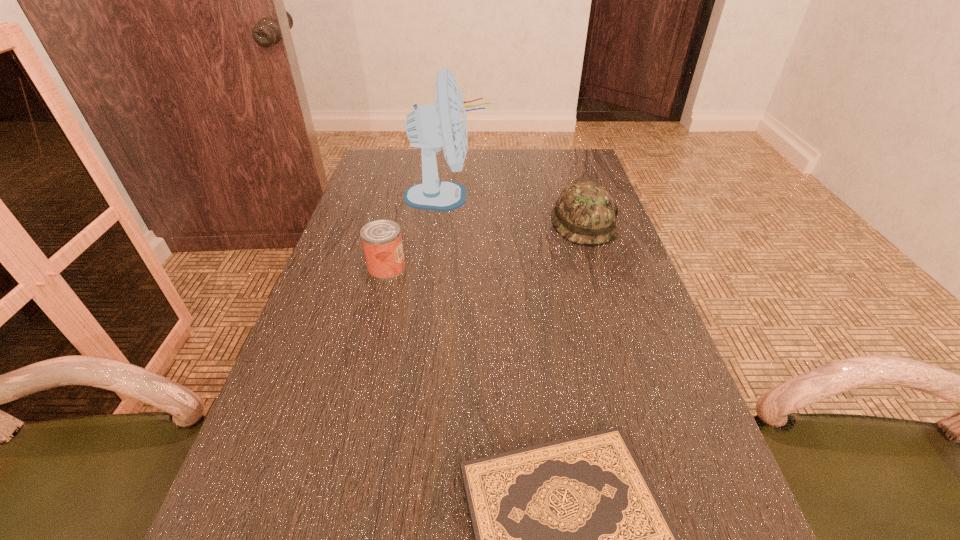
Identify the location of the second closest object to the third farthest object. (584, 213).

What are the coordinates of `object that is the third closest to the nearest object` in the screenshot? It's located at (444, 124).

Identify the location of free location that satisfies the following two spatial constraints: 1. on the grille of the fan; 2. on the front side of the can. This screenshot has height=540, width=960. (440, 268).

Where is `blank space that satisfies the following two spatial constraints: 1. on the grille of the fan; 2. on the right side of the headwear`? This screenshot has height=540, width=960. blank space that satisfies the following two spatial constraints: 1. on the grille of the fan; 2. on the right side of the headwear is located at coordinates (444, 223).